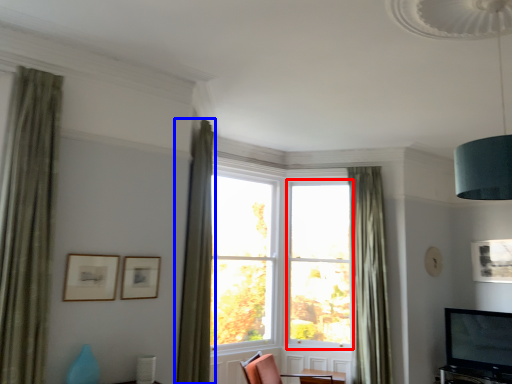
Question: Which object appears farthest to the camera in this image, window frame (highlighted by a red box) or curtain (highlighted by a blue box)?

Choices:
 (A) window frame
 (B) curtain

Answer: (A)